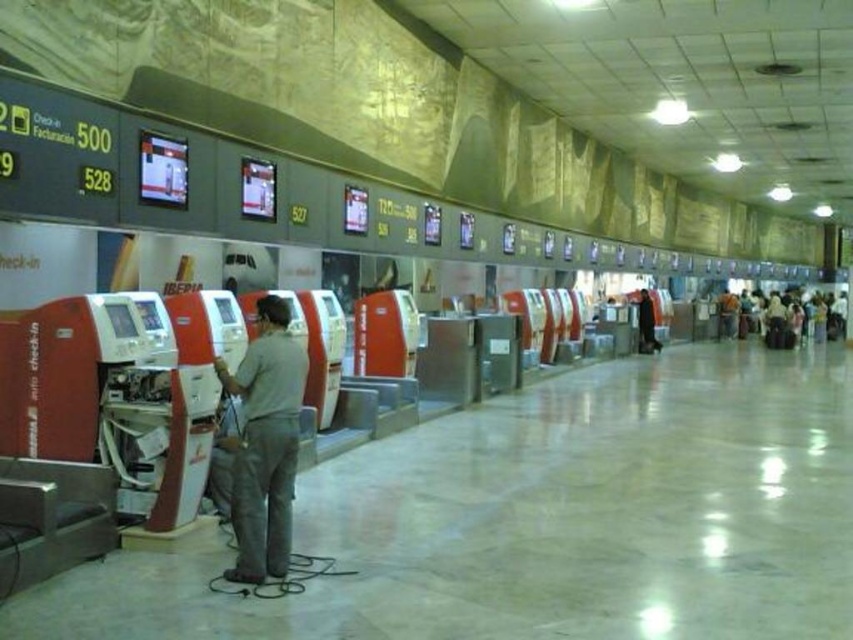
You are a traveler carrying a light brown fabric bag at right and a light brown leather jacket at center. You want to place both items on a nearby bench. However, the bench is only wide enough for one item. Based on their widths, which item should you place on the bench first to ensure both can fit?

The light brown fabric bag at right might be wider than the light brown leather jacket at center, so you should place the lighter item first. However, since the bench can only fit one item, you need to choose the narrower one. Since the jacket is likely narrower, place the light brown leather jacket at center first and then the bag may not fit. Alternatively, check the exact width difference to decide.

You are a traveler who just arrived at the airport and need to check your luggage. You have a light brown fabric bag at right and a light brown leather jacket at center. Which item is taller?

The light brown fabric bag at right is taller than the light brown leather jacket at center.